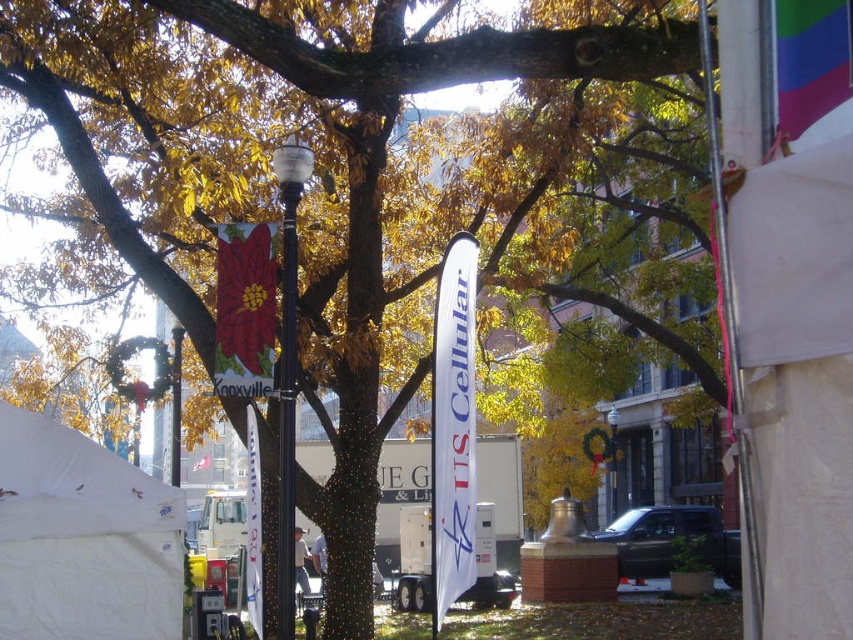
Between point (33, 513) and point (178, 426), which one is positioned in front?

Point (33, 513) is more forward.

Consider the image. Which is above, white fabric tent at lower left or black polished pole at center?

Positioned higher is black polished pole at center.

Image resolution: width=853 pixels, height=640 pixels. I want to click on white fabric tent at lower left, so click(x=83, y=538).

This screenshot has width=853, height=640. What are the coordinates of `white fabric tent at lower left` in the screenshot? It's located at (83, 538).

Does point (144, 531) come closer to viewer compared to point (463, 241)?

That is False.

Is the position of white fabric tent at lower left more distant than that of white fabric banner at center?

Yes.

Is point (122, 592) closer to viewer compared to point (434, 531)?

No, (122, 592) is further to viewer.

At what (x,y) coordinates should I click in order to perform the action: click on white fabric tent at lower left. Please return your answer as a coordinate pair (x, y). The image size is (853, 640). Looking at the image, I should click on (83, 538).

Identify the location of metallic lamp post at center. This screenshot has width=853, height=640. (288, 365).

Measure the distance between point (288, 248) and camera.

Point (288, 248) is 29.34 feet away from camera.

Identify the location of metallic lamp post at center. The height and width of the screenshot is (640, 853). (288, 365).